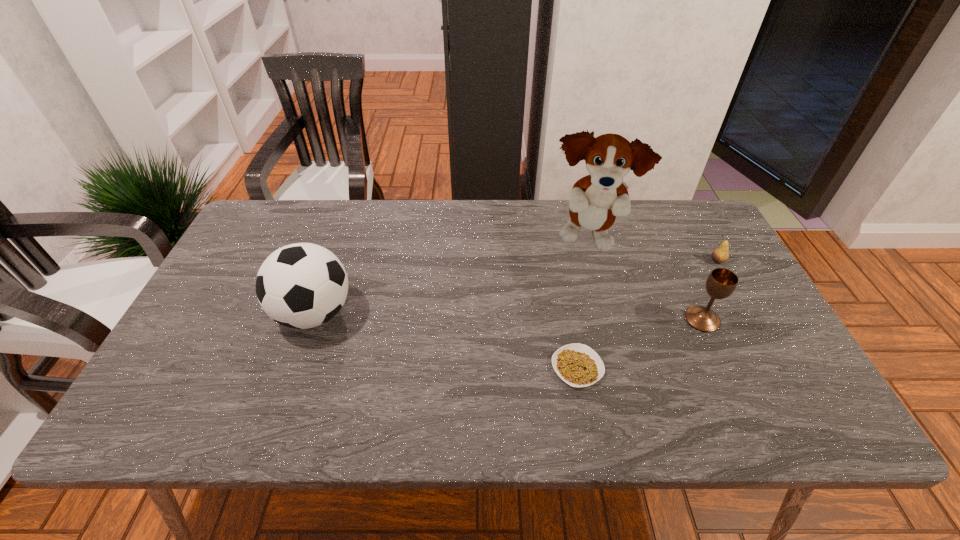
At what (x,y) coordinates should I click in order to perform the action: click on free space located on the front of the third shortest object. Please return your answer as a coordinate pair (x, y). Image resolution: width=960 pixels, height=540 pixels. Looking at the image, I should click on (728, 374).

Where is `free location located on the front of the pear`? free location located on the front of the pear is located at coordinates (727, 278).

This screenshot has width=960, height=540. I want to click on free location located on the back of the legume, so click(x=565, y=300).

You are a GUI agent. You are given a task and a screenshot of the screen. Output one action in this format:
    pyautogui.click(x=<x>, y=<y>)
    Task: Click on the object situated at the far edge
    Image resolution: width=960 pixels, height=540 pixels.
    Given the screenshot: What is the action you would take?
    pyautogui.click(x=595, y=200)

The image size is (960, 540). Find the location of `chalice situated at the right edge`. chalice situated at the right edge is located at coordinates (721, 283).

Locate an element on the screen. pear situated at the right edge is located at coordinates (720, 254).

Where is `free space at the far edge of the desktop`? The width and height of the screenshot is (960, 540). free space at the far edge of the desktop is located at coordinates (402, 221).

You are a GUI agent. You are given a task and a screenshot of the screen. Output one action in this format:
    pyautogui.click(x=<x>, y=<y>)
    Task: Click on the vacant region at the near edge
    The image size is (960, 540).
    Given the screenshot: What is the action you would take?
    pyautogui.click(x=357, y=434)

Where is `free space at the left edge of the desktop`? This screenshot has height=540, width=960. free space at the left edge of the desktop is located at coordinates (242, 278).

In the image, there is a desktop. Find the location of `vacant space at the right edge`. vacant space at the right edge is located at coordinates (699, 298).